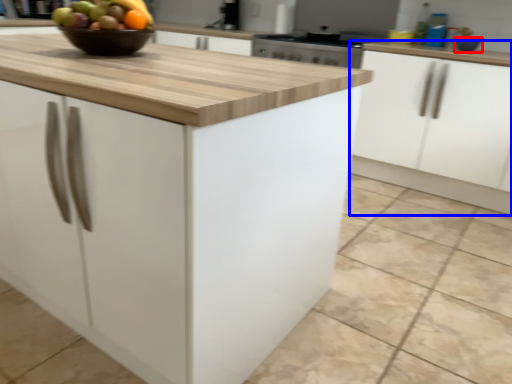
Question: Which point is closer to the camera, bowl (highlighted by a red box) or cabinetry (highlighted by a blue box)?

Choices:
 (A) bowl
 (B) cabinetry

Answer: (B)